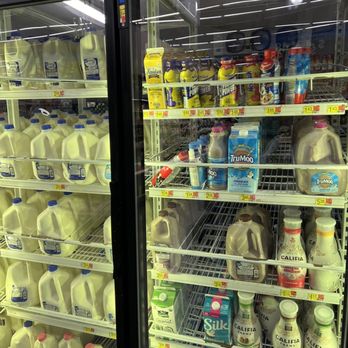
The image size is (348, 348). What are the coordinates of `shelf fronts` in the screenshot? It's located at (37, 94), (42, 185), (45, 259), (52, 320), (176, 346), (197, 280), (268, 198), (254, 111).